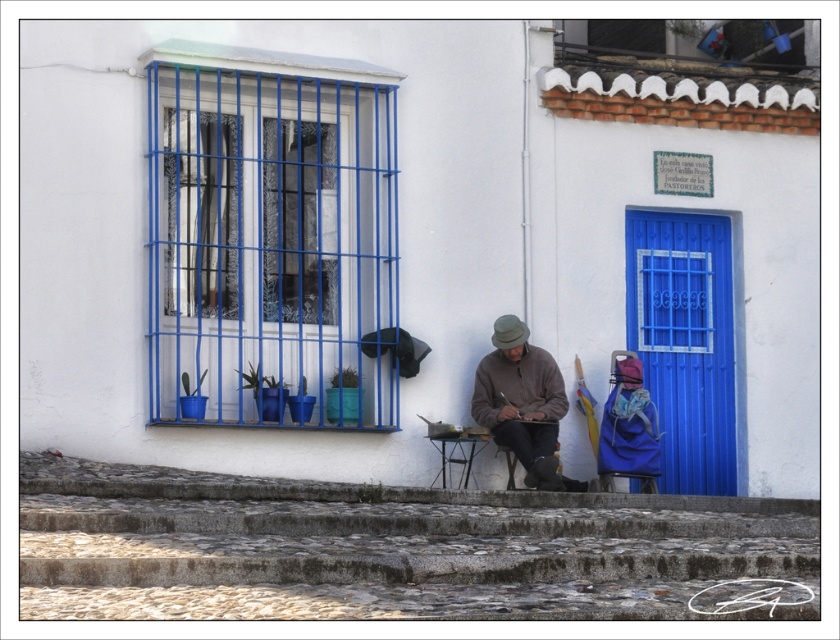
Question: Can you confirm if blue fabric chair at lower right is positioned above wooden chair at lower center?

Choices:
 (A) yes
 (B) no

Answer: (A)

Question: Which point appears closest to the camera in this image?

Choices:
 (A) (675, 369)
 (B) (211, 392)
 (C) (508, 337)
 (D) (639, 404)

Answer: (B)

Question: Estimate the real-world distances between objects in this image. Which object is closer to the wooden chair at lower center?

Choices:
 (A) brown woolen sweater at center
 (B) blue painted wood door at right
 (C) blue metal bars at upper left

Answer: (A)

Question: Does blue metal bars at upper left lie behind brown woolen sweater at center?

Choices:
 (A) yes
 (B) no

Answer: (B)

Question: Among these points, which one is farthest from the camera?

Choices:
 (A) (663, 401)
 (B) (499, 428)
 (C) (313, 196)
 (D) (476, 387)

Answer: (A)

Question: Is blue painted wood door at right bigger than blue fabric chair at lower right?

Choices:
 (A) no
 (B) yes

Answer: (B)